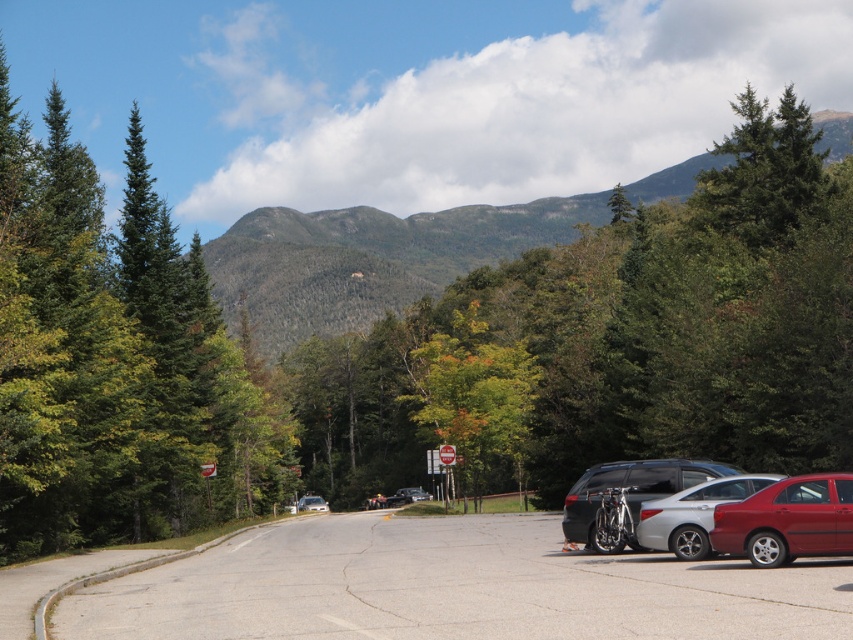
From the picture: Is gray asphalt parking lot at center smaller than shiny red sedan at lower right?

Incorrect, gray asphalt parking lot at center is not smaller in size than shiny red sedan at lower right.

Is point (364, 604) positioned after point (740, 504)?

No, (364, 604) is in front of (740, 504).

This screenshot has height=640, width=853. In order to click on gray asphalt parking lot at center in this screenshot , I will do `click(451, 588)`.

Between green forested mountain at upper center and green leafy tree at center, which one has more height?

green forested mountain at upper center

Between point (386, 221) and point (430, 424), which one is positioned in front?

Point (430, 424) is more forward.

Image resolution: width=853 pixels, height=640 pixels. Find the location of `green forested mountain at upper center`. green forested mountain at upper center is located at coordinates (368, 259).

Who is more distant from viewer, [759,140] or [660,474]?

Positioned behind is point [759,140].

Between green evergreen tree at upper right and metallic silver car at center-right, which one has less height?

Standing shorter between the two is metallic silver car at center-right.

At what (x,y) coordinates should I click in order to perform the action: click on green evergreen tree at upper right. Please return your answer as a coordinate pair (x, y). The image size is (853, 640). Looking at the image, I should click on (762, 172).

Locate an element on the screen. The height and width of the screenshot is (640, 853). green evergreen tree at upper right is located at coordinates (762, 172).